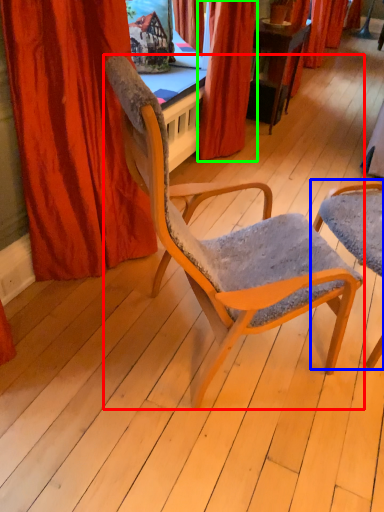
Question: Considering the real-world distances, which object is closest to chair (highlighted by a red box)? chair (highlighted by a blue box) or curtain (highlighted by a green box).

Choices:
 (A) chair
 (B) curtain

Answer: (A)